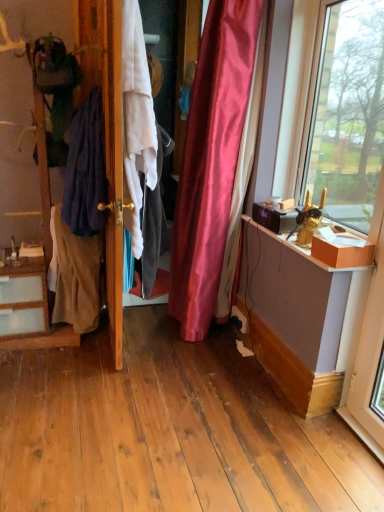
Question: Considering the relative sizes of wooden dresser at left and wooden door at center in the image provided, is wooden dresser at left smaller than wooden door at center?

Choices:
 (A) no
 (B) yes

Answer: (A)

Question: Is wooden dresser at left closer to camera compared to wooden door at center?

Choices:
 (A) no
 (B) yes

Answer: (A)

Question: From the image's perspective, does wooden dresser at left appear lower than wooden door at center?

Choices:
 (A) no
 (B) yes

Answer: (B)

Question: Can you confirm if wooden dresser at left is taller than wooden door at center?

Choices:
 (A) no
 (B) yes

Answer: (A)

Question: Could wooden door at center be considered to be inside wooden dresser at left?

Choices:
 (A) no
 (B) yes

Answer: (A)

Question: Is wooden dresser at left oriented away from wooden door at center?

Choices:
 (A) yes
 (B) no

Answer: (B)

Question: Can you confirm if wooden door at center is smaller than dark blue fabric at left, positioned as the second clothing in left-to-right order?

Choices:
 (A) no
 (B) yes

Answer: (A)

Question: Is wooden door at center oriented towards dark blue fabric at left, positioned as the second clothing in left-to-right order?

Choices:
 (A) yes
 (B) no

Answer: (B)

Question: Is wooden door at center outside of dark blue fabric at left, positioned as the second clothing in left-to-right order?

Choices:
 (A) yes
 (B) no

Answer: (A)

Question: From the image's perspective, is wooden door at center on top of dark blue fabric at left, the second clothing in the right-to-left sequence?

Choices:
 (A) no
 (B) yes

Answer: (A)

Question: Considering the relative positions of wooden door at center and dark blue fabric at left, positioned as the second clothing in left-to-right order, in the image provided, is wooden door at center to the right of dark blue fabric at left, positioned as the second clothing in left-to-right order, from the viewer's perspective?

Choices:
 (A) no
 (B) yes

Answer: (B)

Question: Is wooden door at center looking in the opposite direction of dark blue fabric at left, the second clothing in the right-to-left sequence?

Choices:
 (A) yes
 (B) no

Answer: (B)

Question: Is the depth of dark blue fabric at left, the second clothing in the right-to-left sequence, less than that of dark blue fabric at left, the 3th clothing positioned from the right?

Choices:
 (A) yes
 (B) no

Answer: (A)